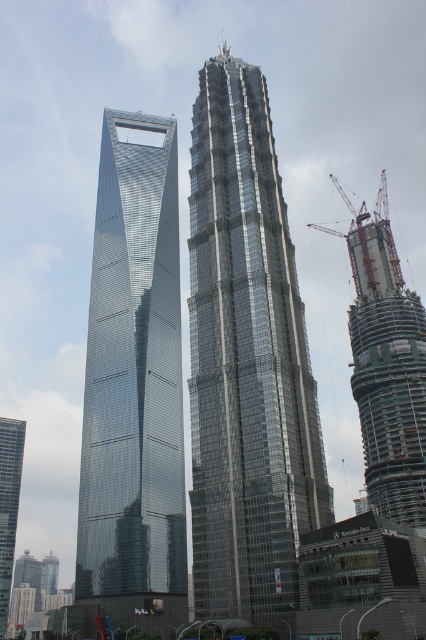
You are standing on an observation deck overlooking the city. You see the shiny glass skyscraper at center. If you want to take a photo of it without including any other buildings, which direction should you move to frame it better?

The shiny glass skyscraper at center is 79.67 meters away from the viewer. To frame it without including other buildings, move closer to it to reduce the field of view, ensuring only the skyscraper is in the shot.

You are an architect analyzing the Shanghai skyline. You observe the shiny glass skyscraper at left and the glassy metallic skyscraper at left. Which of these two skyscrapers has a greater width?

The shiny glass skyscraper at left has a greater width than the glassy metallic skyscraper at left according to the description.

You are an urban planner assessing the skyline. The shiny glass skyscraper at center and the metallic construction crane at right are both visible from the park across the street. Which one appears narrower when viewed from the park?

The shiny glass skyscraper at center appears narrower than the metallic construction crane at right because its width is less than the crane.